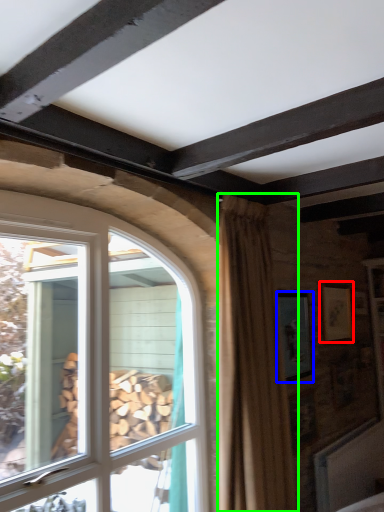
Question: Estimate the real-world distances between objects in this image. Which object is closer to picture frame (highlighted by a red box), picture frame (highlighted by a blue box) or curtain (highlighted by a green box)?

Choices:
 (A) picture frame
 (B) curtain

Answer: (A)